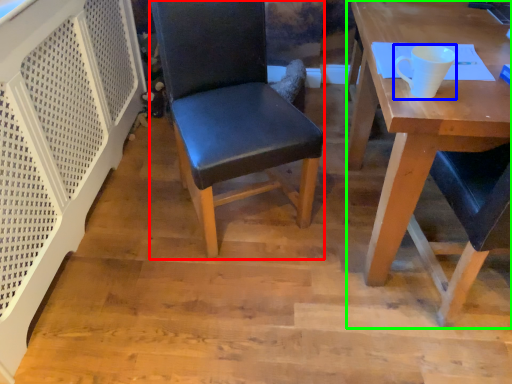
Question: Which object is positioned closest to chair (highlighted by a red box)? Select from coffee cup (highlighted by a blue box) and desk (highlighted by a green box).

Choices:
 (A) coffee cup
 (B) desk

Answer: (B)